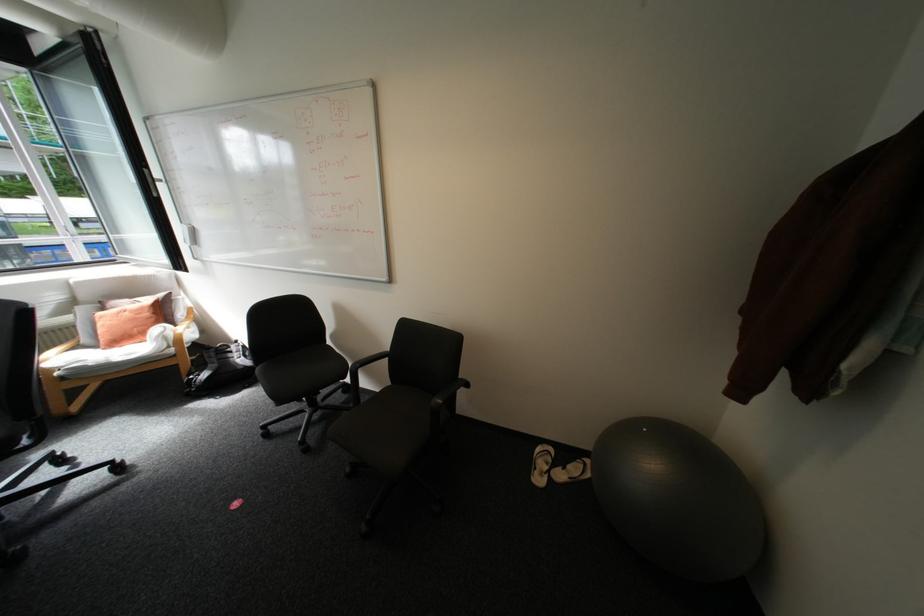
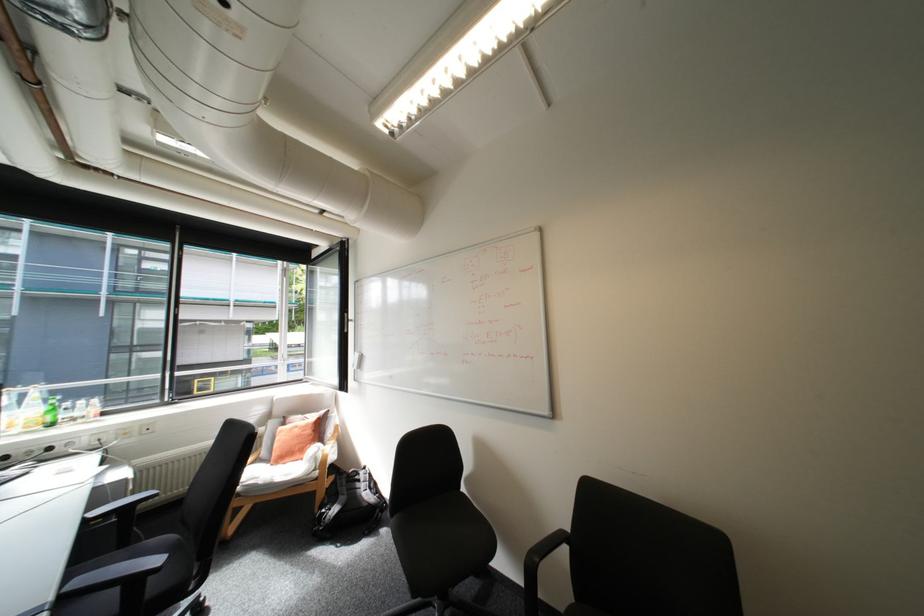
The images are taken continuously from a first-person perspective. In which direction is your viewpoint rotating?

The camera's rotation is toward left-up.